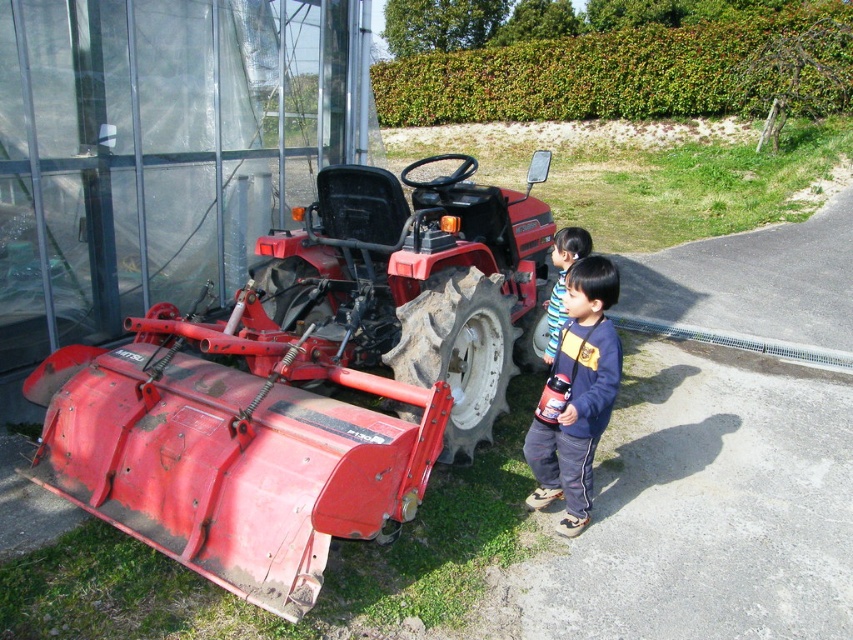
Question: Which point is farther to the camera?

Choices:
 (A) (540, 397)
 (B) (598, 289)

Answer: (A)

Question: Estimate the real-world distances between objects in this image. Which object is closer to the blue cotton shirt at lower right?

Choices:
 (A) red matte tractor at center
 (B) glossy plastic bottle at lower right
 (C) striped shirt at center

Answer: (B)

Question: Which point appears closest to the camera in this image?

Choices:
 (A) (326, 225)
 (B) (548, 390)
 (C) (573, 506)
 (D) (572, 250)

Answer: (B)

Question: Is the position of red matte tractor at center more distant than that of blue cotton shirt at lower right?

Choices:
 (A) no
 (B) yes

Answer: (A)

Question: Can you confirm if red matte tractor at center is wider than blue cotton shirt at lower right?

Choices:
 (A) yes
 (B) no

Answer: (A)

Question: Is red matte tractor at center positioned before blue cotton shirt at lower right?

Choices:
 (A) yes
 (B) no

Answer: (A)